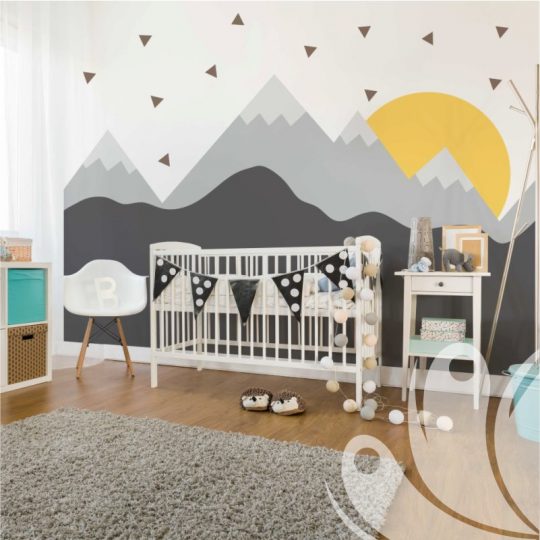
This screenshot has width=540, height=540. Identify the location of dresser. (457, 284).